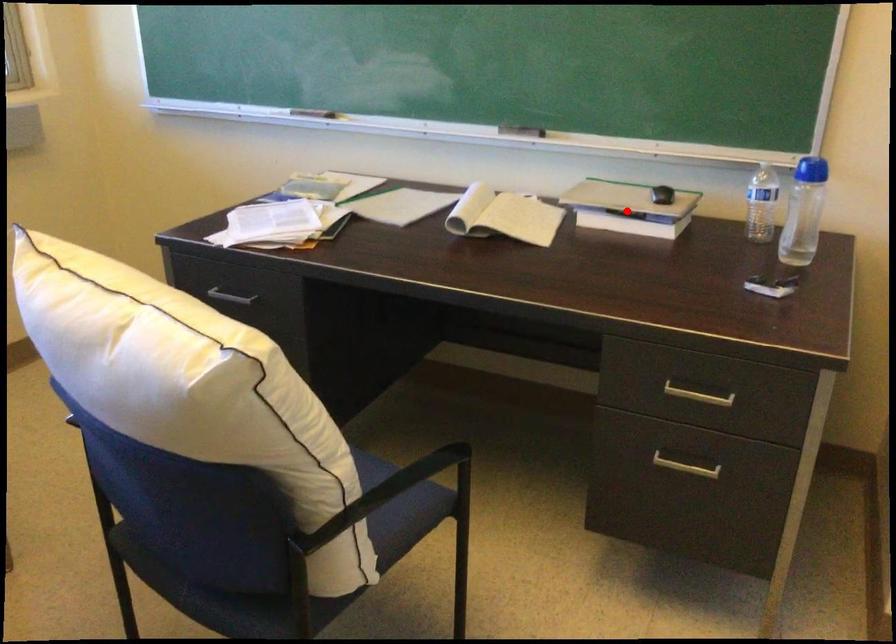
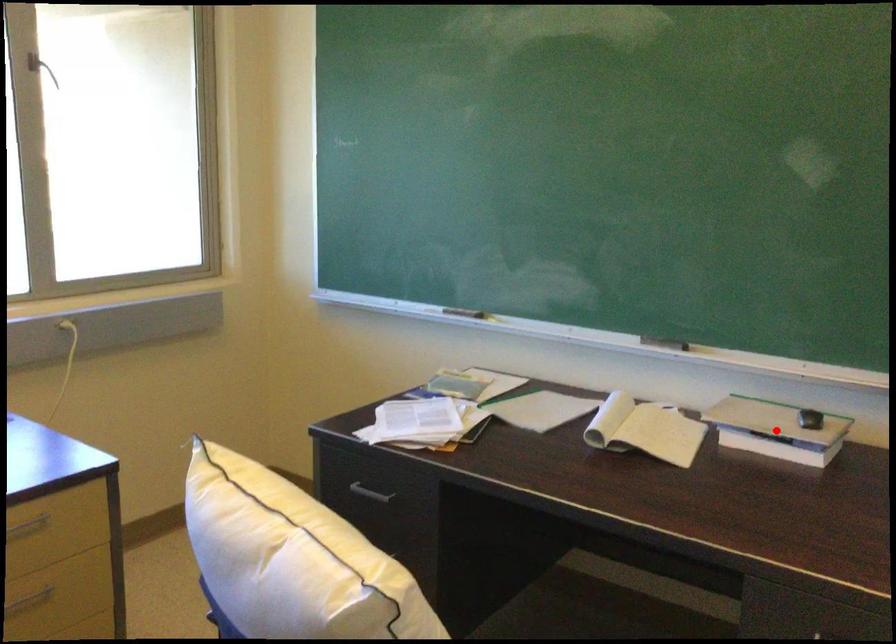
I am providing you with two images of the same scene from different viewpoints. A red point is marked on the first image and another point is marked on the second image. Is the marked point in image1 the same physical position as the marked point in image2?

Yes